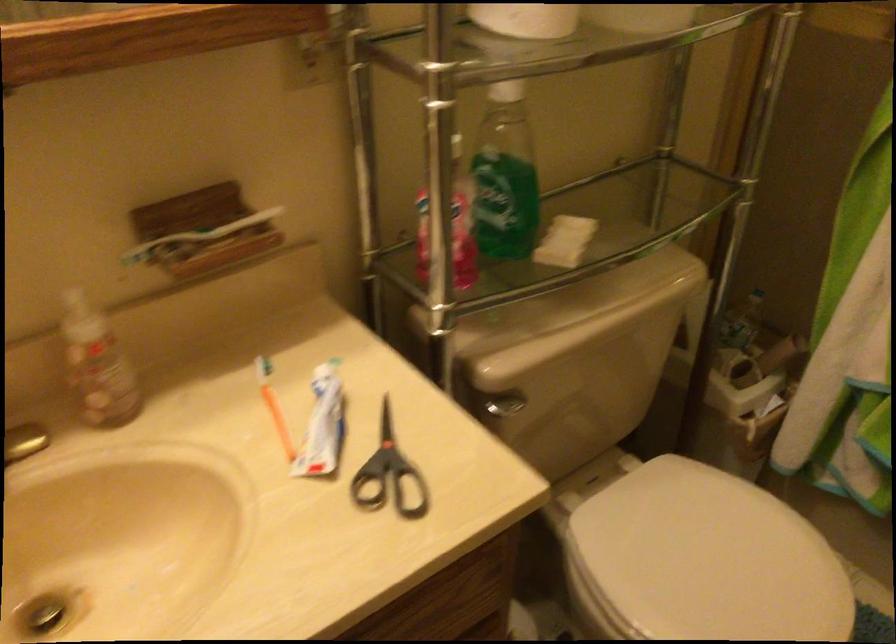
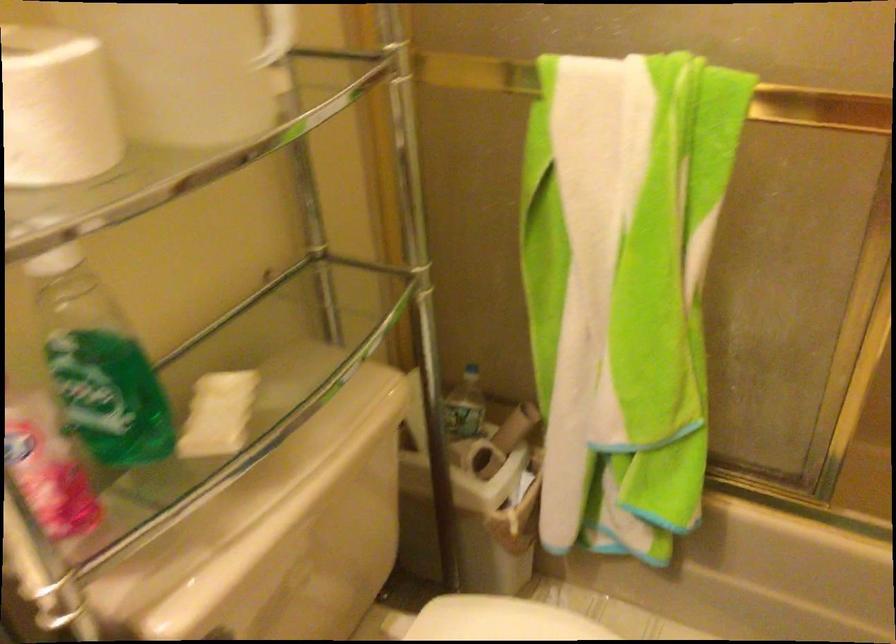
What movement of the cameraman would produce the second image?

The movement direction of the cameraman is right, forward.